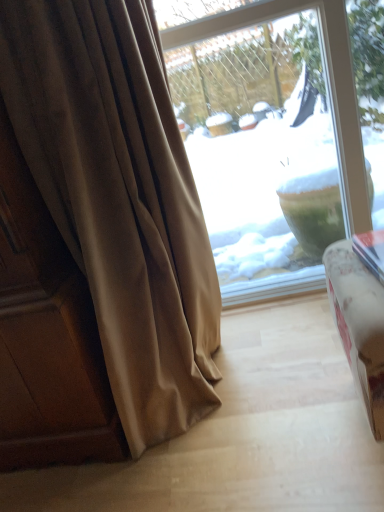
Find the location of `vacant area in front of brown silk curtain at left`. vacant area in front of brown silk curtain at left is located at coordinates (234, 474).